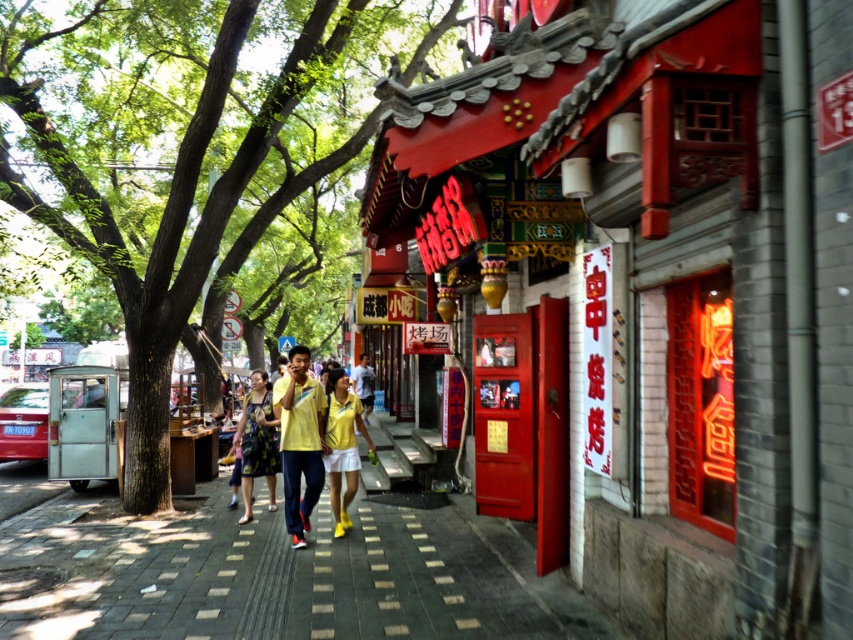
You are standing on the sidewalk in this traditional Chinese street scene. You notice a green leafy tree at left and yellow fabric pants at center. Which object is higher up in the scene?

The green leafy tree at left is located above the yellow fabric pants at center, so it is higher up in the scene.

You are standing on the gray brick pavement in the street scene and want to find the point marked at coordinates (x=177, y=157). According to the scene description, where would this point be located?

The point at coordinates (x=177, y=157) is located on the green leafy tree at left.